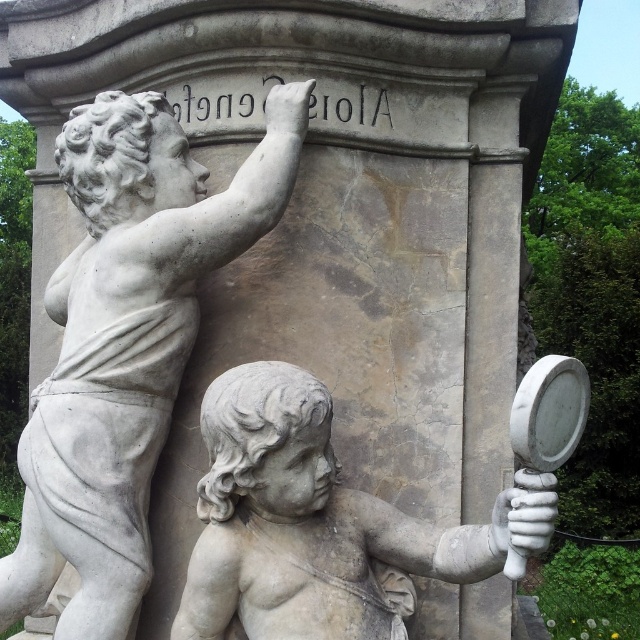
You are standing in front of the two statues and want to place a small flower at the base of the statue that is closer to you. Which statue should you place the flower at the base of, the one at point (108, 221) or the one at point (305, 560)?

You should place the flower at the base of the statue at point (305, 560) because point (108, 221) is behind point (305, 560), meaning the statue at (305, 560) is closer to you.

You are an architect designing a virtual tour of this monument. You need to place a spotlight exactly at the center of the white marble cherub at upper left. What are the coordinates where you should position the spotlight?

The coordinates for the center of the white marble cherub at upper left are at point (125,340).